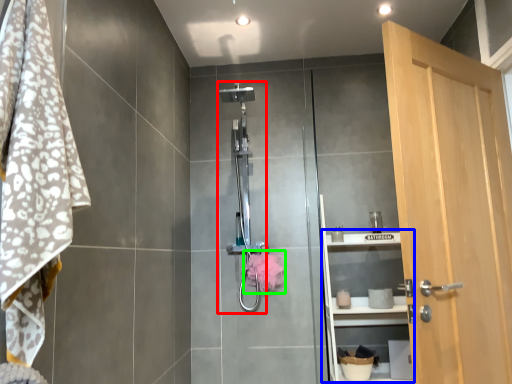
Question: Based on their relative distances, which object is farther from shower (highlighted by a red box)? Choose from shelf (highlighted by a blue box) and hand towel (highlighted by a green box).

Choices:
 (A) shelf
 (B) hand towel

Answer: (A)